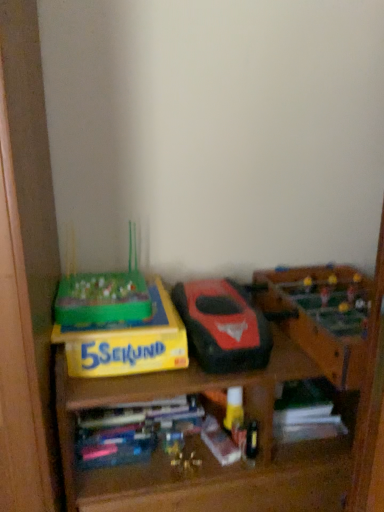
Question: Can you confirm if multicolored plastic books at center, acting as the 1th book starting from the left, is positioned to the left of yellow cardboard box at left?

Choices:
 (A) yes
 (B) no

Answer: (A)

Question: Can you confirm if multicolored plastic books at center, acting as the 1th book starting from the left, is smaller than yellow cardboard box at left?

Choices:
 (A) no
 (B) yes

Answer: (B)

Question: Is multicolored plastic books at center, acting as the 1th book starting from the left, positioned far away from yellow cardboard box at left?

Choices:
 (A) yes
 (B) no

Answer: (B)

Question: Is yellow cardboard box at left located within multicolored plastic books at center, acting as the 1th book starting from the left?

Choices:
 (A) yes
 (B) no

Answer: (B)

Question: Is multicolored plastic books at center, acting as the 1th book starting from the left, closer to camera compared to yellow cardboard box at left?

Choices:
 (A) yes
 (B) no

Answer: (B)

Question: In the image, is yellow cardboard box at left positioned in front of or behind yellow matte board game at left?

Choices:
 (A) behind
 (B) front

Answer: (B)

Question: Would you say yellow cardboard box at left is to the left or to the right of yellow matte board game at left in the picture?

Choices:
 (A) left
 (B) right

Answer: (B)

Question: In terms of height, does yellow cardboard box at left look taller or shorter compared to yellow matte board game at left?

Choices:
 (A) tall
 (B) short

Answer: (A)

Question: From the image's perspective, is yellow cardboard box at left positioned above or below yellow matte board game at left?

Choices:
 (A) below
 (B) above

Answer: (A)

Question: Choose the correct answer: Is wooden foosball table at right, arranged as the first toy when viewed from the right, inside yellow matte board game at left or outside it?

Choices:
 (A) inside
 (B) outside

Answer: (B)

Question: Is wooden foosball table at right, which is the 2th toy in left-to-right order, in front of or behind yellow matte board game at left in the image?

Choices:
 (A) behind
 (B) front

Answer: (B)

Question: Is point (324, 278) closer or farther from the camera than point (84, 369)?

Choices:
 (A) farther
 (B) closer

Answer: (A)

Question: Looking at the image, does wooden foosball table at right, arranged as the first toy when viewed from the right, seem bigger or smaller compared to yellow matte board game at left?

Choices:
 (A) big
 (B) small

Answer: (A)

Question: From a real-world perspective, is multicolored plastic books at center, acting as the 1th book starting from the left, physically located above or below matte black toy car at center, arranged as the second toy when viewed from the right?

Choices:
 (A) above
 (B) below

Answer: (B)

Question: Looking at their shapes, would you say multicolored plastic books at center, acting as the 1th book starting from the left, is wider or thinner than matte black toy car at center, which ranks as the first toy in left-to-right order?

Choices:
 (A) wide
 (B) thin

Answer: (B)